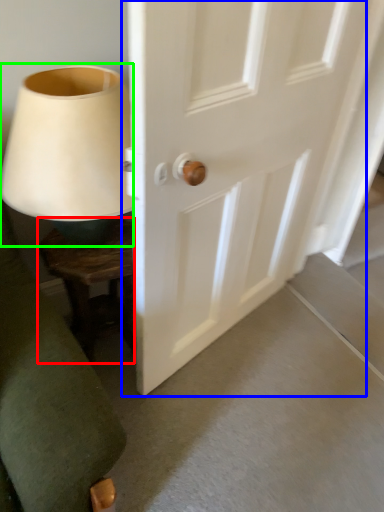
Question: Which is farther away from furniture (highlighted by a red box)? door (highlighted by a blue box) or table lamp (highlighted by a green box)?

Choices:
 (A) door
 (B) table lamp

Answer: (A)